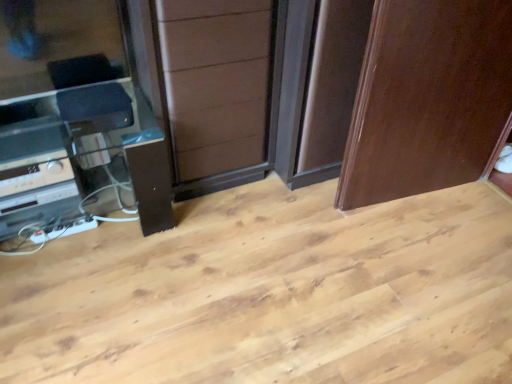
Question: Is brown wood screen door at center facing away from satin black entertainment center at left?

Choices:
 (A) yes
 (B) no

Answer: (B)

Question: Can you confirm if brown wood screen door at center is shorter than satin black entertainment center at left?

Choices:
 (A) no
 (B) yes

Answer: (A)

Question: From a real-world perspective, is brown wood screen door at center under satin black entertainment center at left?

Choices:
 (A) no
 (B) yes

Answer: (A)

Question: From the image's perspective, would you say brown wood screen door at center is positioned over satin black entertainment center at left?

Choices:
 (A) yes
 (B) no

Answer: (A)

Question: Is brown wood screen door at center facing towards satin black entertainment center at left?

Choices:
 (A) no
 (B) yes

Answer: (A)

Question: Is satin black stereo at lower left in front of or behind satin black entertainment center at left in the image?

Choices:
 (A) behind
 (B) front

Answer: (A)

Question: Based on their positions, is satin black stereo at lower left located to the left or right of satin black entertainment center at left?

Choices:
 (A) left
 (B) right

Answer: (A)

Question: From the image's perspective, relative to satin black entertainment center at left, is satin black stereo at lower left above or below?

Choices:
 (A) above
 (B) below

Answer: (A)

Question: Considering the positions of satin black stereo at lower left and satin black entertainment center at left in the image, is satin black stereo at lower left taller or shorter than satin black entertainment center at left?

Choices:
 (A) short
 (B) tall

Answer: (A)

Question: Considering the relative positions of satin black stereo at lower left and glossy wood door at upper right in the image provided, is satin black stereo at lower left to the left or to the right of glossy wood door at upper right?

Choices:
 (A) left
 (B) right

Answer: (A)

Question: From the image's perspective, is satin black stereo at lower left positioned above or below glossy wood door at upper right?

Choices:
 (A) below
 (B) above

Answer: (A)

Question: In terms of size, does satin black stereo at lower left appear bigger or smaller than glossy wood door at upper right?

Choices:
 (A) big
 (B) small

Answer: (B)

Question: Considering the positions of point (59, 178) and point (437, 59), is point (59, 178) closer or farther from the camera than point (437, 59)?

Choices:
 (A) closer
 (B) farther

Answer: (A)

Question: In terms of height, does glossy wood door at upper right look taller or shorter compared to brown wood screen door at center?

Choices:
 (A) tall
 (B) short

Answer: (A)

Question: Is glossy wood door at upper right wider or thinner than brown wood screen door at center?

Choices:
 (A) wide
 (B) thin

Answer: (B)